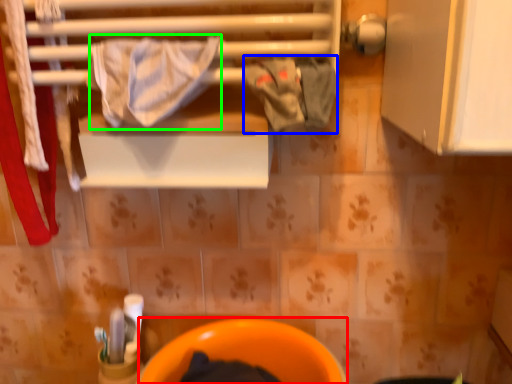
Question: Based on their relative distances, which object is farther from toilet bowl (highlighted by a red box)? Choose from clothing (highlighted by a blue box) and bath towel (highlighted by a green box).

Choices:
 (A) clothing
 (B) bath towel

Answer: (B)